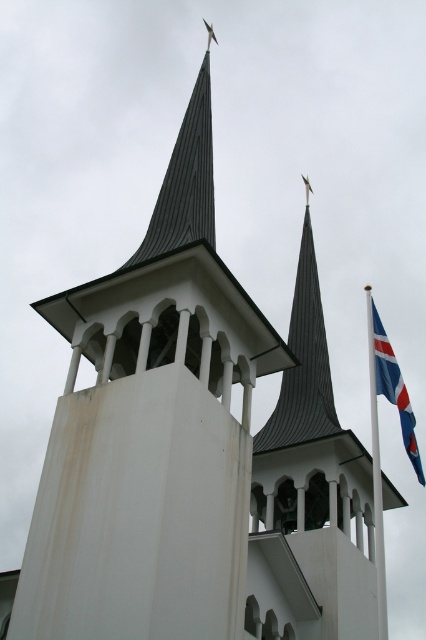
Question: Which point appears farthest from the camera in this image?

Choices:
 (A) (376, 381)
 (B) (385, 568)

Answer: (B)

Question: Which point is farther to the camera?

Choices:
 (A) (376, 410)
 (B) (380, 376)

Answer: (A)

Question: Does white metallic flag pole at right lie behind blue and white fabric flag at right?

Choices:
 (A) no
 (B) yes

Answer: (A)

Question: Does white metallic flag pole at right have a smaller size compared to blue and white fabric flag at right?

Choices:
 (A) yes
 (B) no

Answer: (B)

Question: Is white metallic flag pole at right to the right of blue and white fabric flag at right from the viewer's perspective?

Choices:
 (A) yes
 (B) no

Answer: (A)